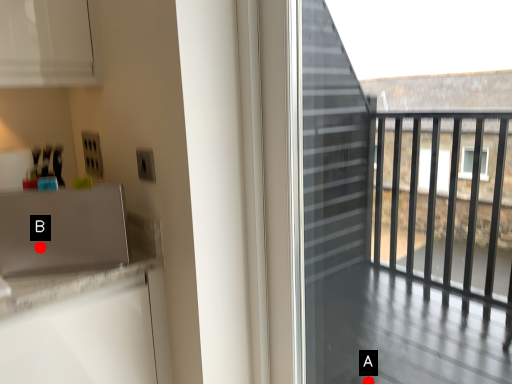
Question: Two points are circled on the image, labeled by A and B beside each circle. Which point is closer to the camera?

Choices:
 (A) A is closer
 (B) B is closer

Answer: (B)